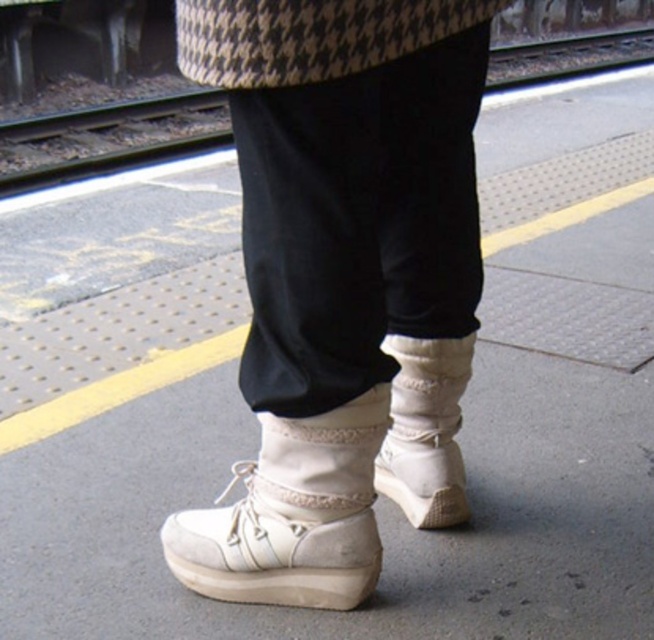
You are a photographer trying to capture the white suede sneakers at center and the metal train track at upper left in the same frame. Based on their sizes, which object should you focus on first to ensure both are in the frame?

The white suede sneakers at center is smaller than the metal train track at upper left, so you should focus on the metal train track at upper left first to ensure both are in the frame since it is larger and might require more adjustment to fit into the shot.

You are a photographer trying to capture the white suede sneaker at center and the metal train track at upper left in a single frame. Based on their sizes, which object should you focus on first to ensure both are in the frame?

The white suede sneaker at center is shorter than the metal train track at upper left, so you should focus on the metal train track at upper left first to ensure both are in the frame.